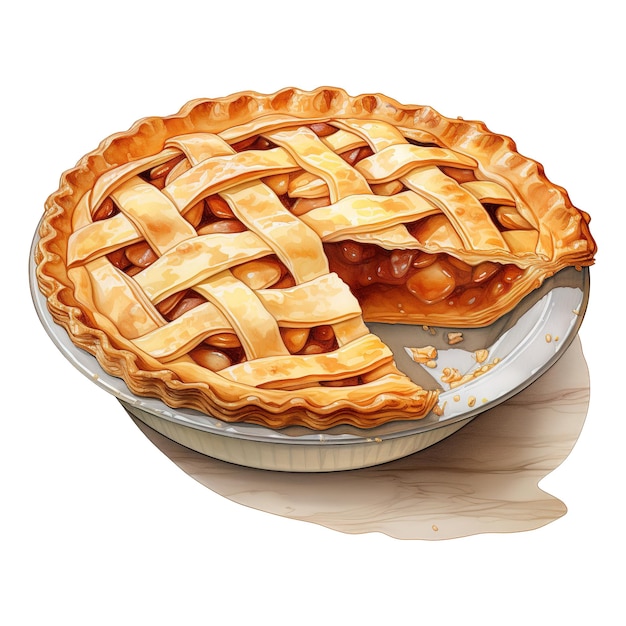
Find the location of a particular element. This screenshot has width=626, height=626. plate is located at coordinates (511, 322).